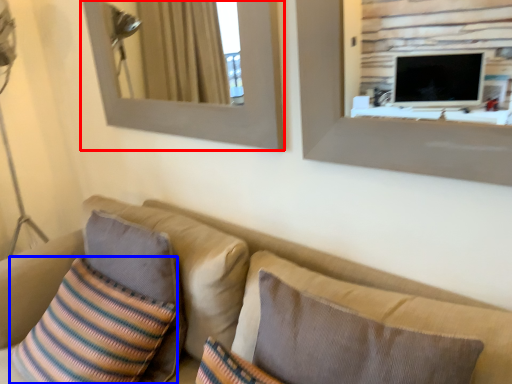
Question: Which of the following is the closest to the observer, picture frame (highlighted by a red box) or throw pillow (highlighted by a blue box)?

Choices:
 (A) picture frame
 (B) throw pillow

Answer: (B)